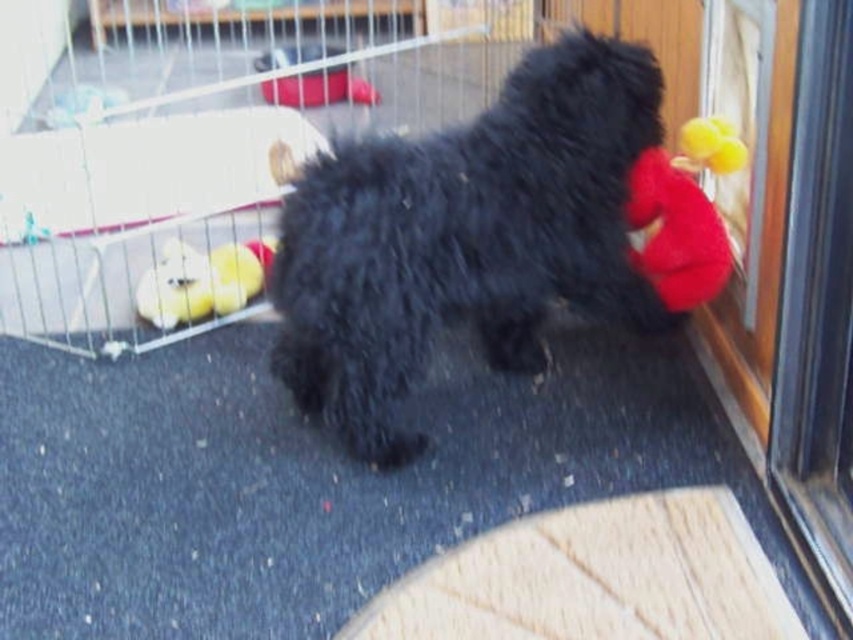
Question: Among these points, which one is farthest from the camera?

Choices:
 (A) (692, 237)
 (B) (25, 227)
 (C) (225, 314)
 (D) (444, 220)

Answer: (B)

Question: Can you confirm if black fluffy dog at center is positioned below yellow plush duck at left?

Choices:
 (A) no
 (B) yes

Answer: (B)

Question: Considering the relative positions of metal wire cage at center and yellow plush duck at left in the image provided, where is metal wire cage at center located with respect to yellow plush duck at left?

Choices:
 (A) left
 (B) right

Answer: (B)

Question: Can you confirm if metal wire cage at center is positioned above black fluffy dog at center?

Choices:
 (A) no
 (B) yes

Answer: (B)

Question: Which of these objects is positioned farthest from the metal wire cage at center?

Choices:
 (A) yellow plush duck at left
 (B) red plush toy at right

Answer: (B)

Question: Estimate the real-world distances between objects in this image. Which object is farther from the metal wire cage at center?

Choices:
 (A) red plush toy at right
 (B) yellow plush duck at left
 (C) black fluffy dog at center

Answer: (A)